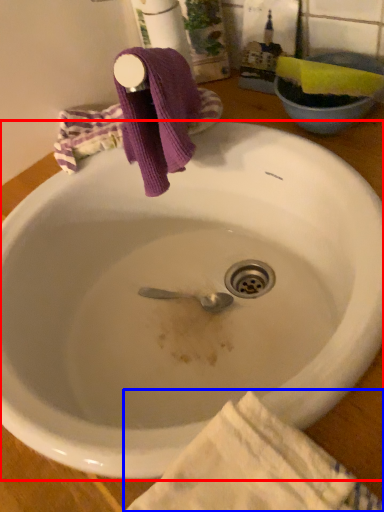
Question: Which object appears closest to the camera in this image, sink (highlighted by a red box) or beach towel (highlighted by a blue box)?

Choices:
 (A) sink
 (B) beach towel

Answer: (B)